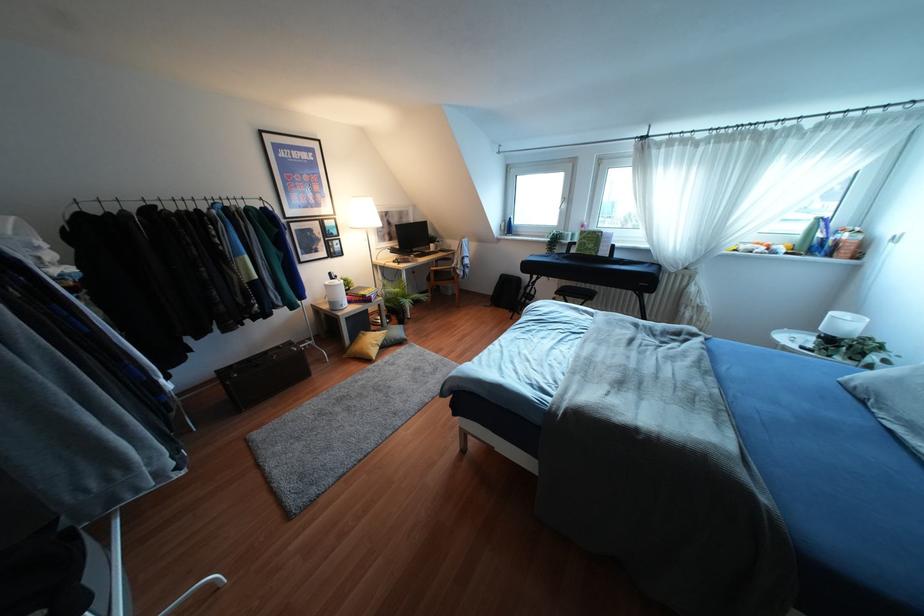
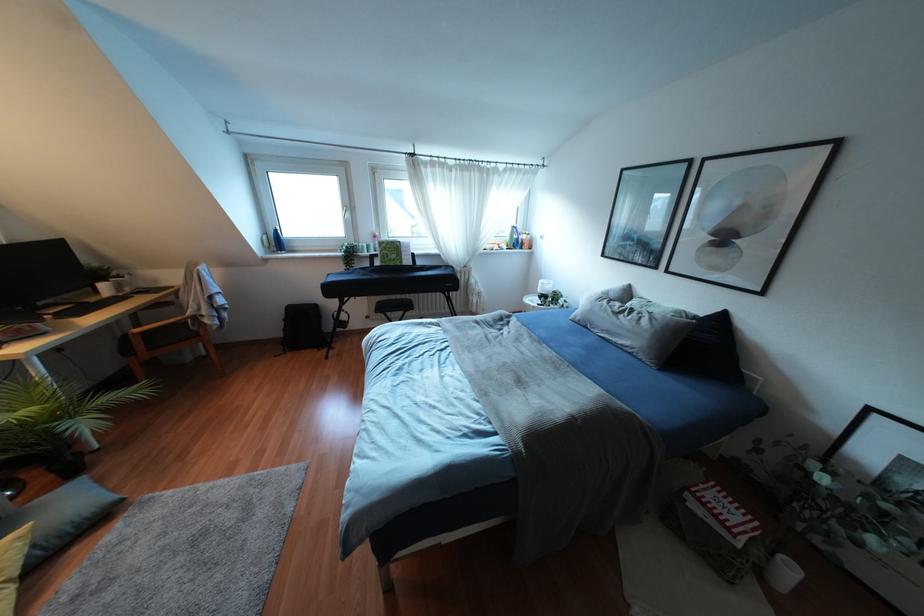
Where in the second image is the point corresponding to (453,278) from the first image?

(196, 334)